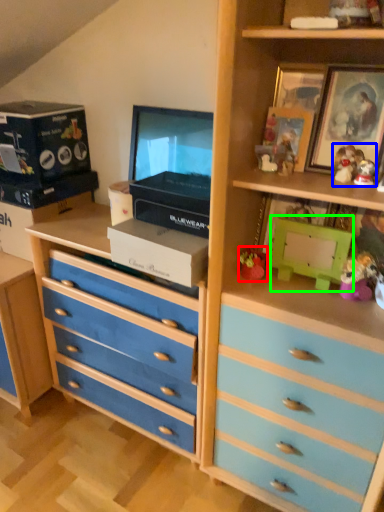
Question: Considering the real-world distances, which object is farthest from toy (highlighted by a red box)? toy (highlighted by a blue box) or box (highlighted by a green box)?

Choices:
 (A) toy
 (B) box

Answer: (A)